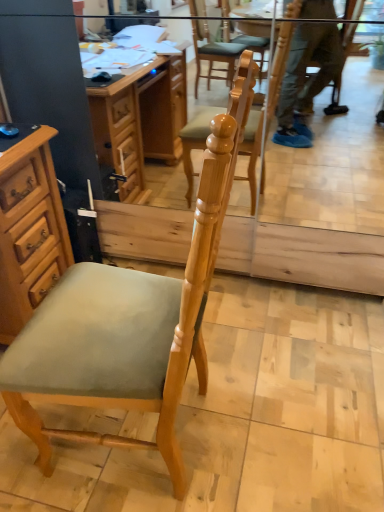
Question: In terms of size, does light brown wood chair at center appear bigger or smaller than wooden cabinet at left?

Choices:
 (A) big
 (B) small

Answer: (A)

Question: From the image's perspective, is light brown wood chair at center positioned above or below wooden cabinet at left?

Choices:
 (A) below
 (B) above

Answer: (A)

Question: Based on their positions, is light brown wood chair at center located to the left or right of wooden cabinet at left?

Choices:
 (A) left
 (B) right

Answer: (B)

Question: Is wooden cabinet at left to the left or to the right of light brown wood chair at center in the image?

Choices:
 (A) left
 (B) right

Answer: (A)

Question: Does point (13, 224) appear closer or farther from the camera than point (56, 381)?

Choices:
 (A) farther
 (B) closer

Answer: (A)

Question: From the image's perspective, is wooden cabinet at left positioned above or below light brown wood chair at center?

Choices:
 (A) below
 (B) above

Answer: (B)

Question: Is wooden cabinet at left in front of or behind light brown wood chair at center in the image?

Choices:
 (A) front
 (B) behind

Answer: (B)